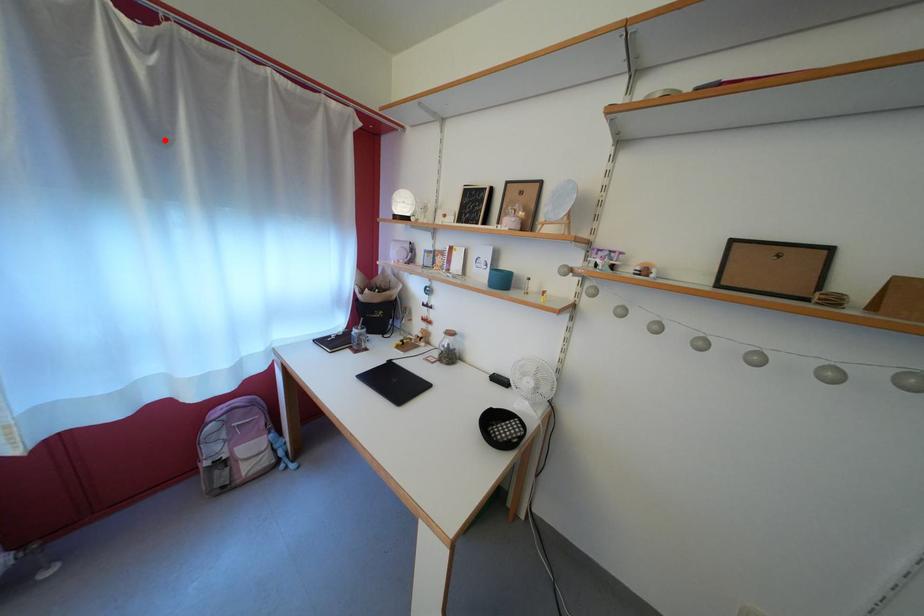
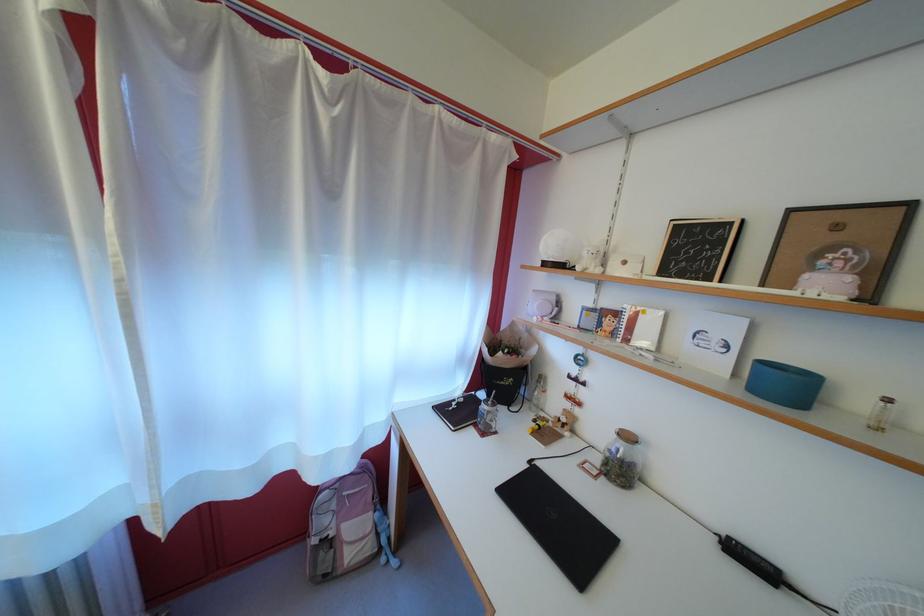
Locate, in the second image, the point that corresponds to the highlighted location in the first image.

(335, 193)